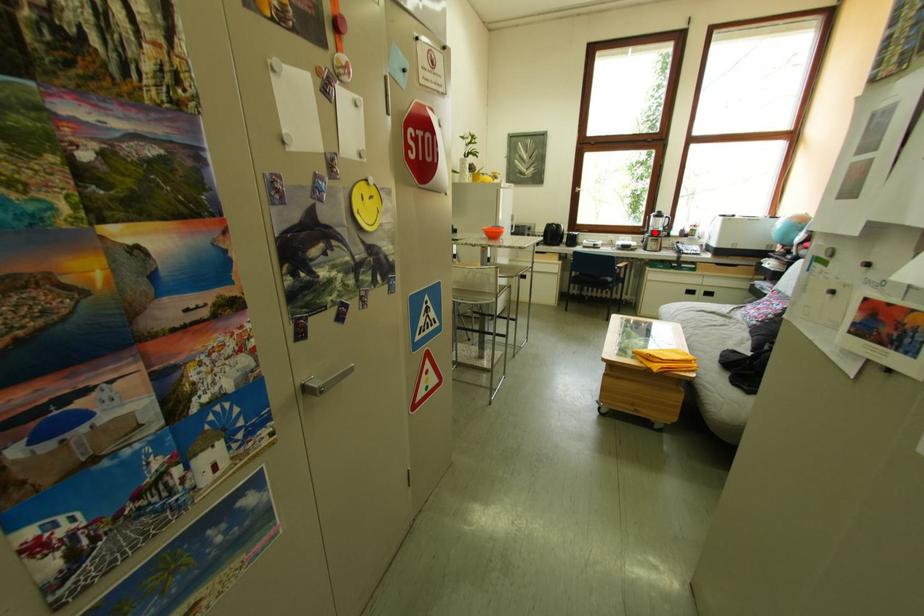
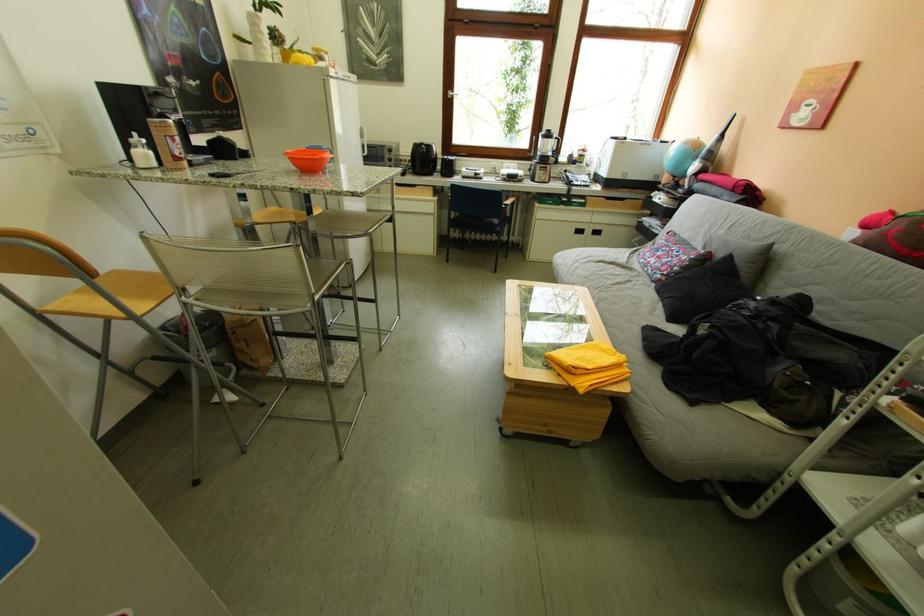
Question: I am providing you with two images of the same scene from different viewpoints. A red point is shown in image1. For the corresponding object point in image2, is it positioned nearer or farther from the camera?

Choices:
 (A) Nearer
 (B) Farther

Answer: (A)